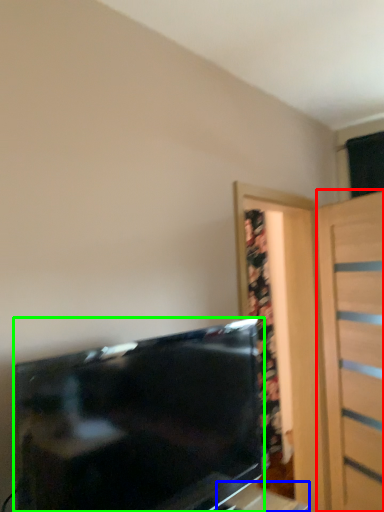
Question: Which object is positioned farthest from door (highlighted by a red box)? Select from table (highlighted by a blue box) and television (highlighted by a green box).

Choices:
 (A) table
 (B) television

Answer: (B)